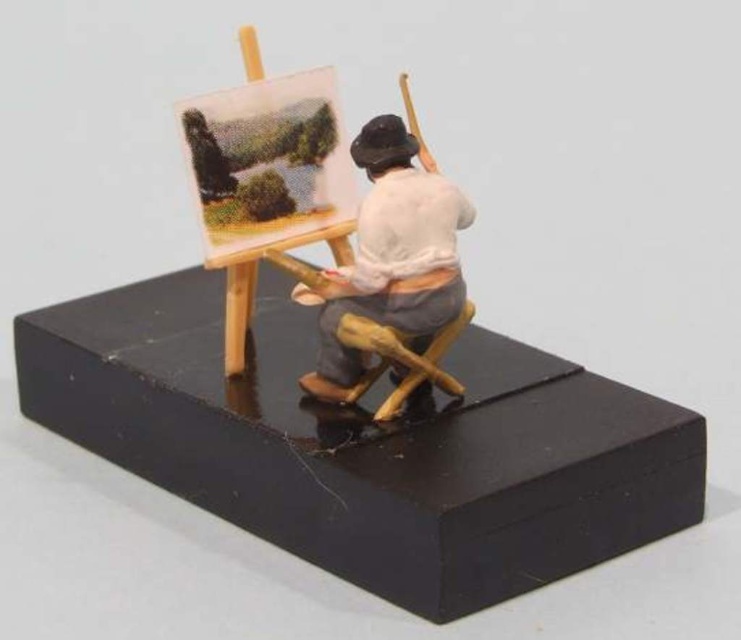
You are a visitor at an art exhibition and see the wooden easel at center and the wooden figure at center in a display case. Which object is positioned to the left side of the other?

The wooden easel at center is to the left of the wooden figure at center.

You are a collector who wants to display the wooden easel at center and the wooden figure at center on a shelf. If the shelf has a height limit of 12 inches, can both items be placed on it without exceeding the height limit?

The wooden easel at center is taller than the wooden figure at center. However, without specific height measurements for each item, it is impossible to determine if their combined or individual heights exceed the 12 inch limit. Additional information about their exact heights is needed to answer accurately.

You are a photographer aiming to capture the figurine from a specific angle where both points are visible. Given that point 1 is at coordinate point (325, 128) and point 2 is at coordinate point (445, 266), which point is positioned further back in the scene?

Point (325, 128) is behind point (445, 266), so it is positioned further back in the scene.